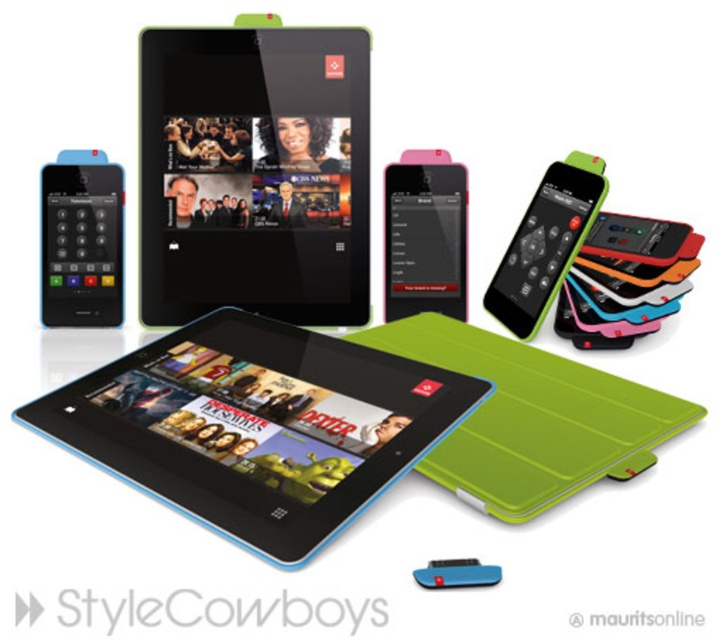
Question: Which point is closer to the camera?

Choices:
 (A) (585, 184)
 (B) (370, 442)

Answer: (B)

Question: Among these points, which one is farthest from the camera?

Choices:
 (A) (531, 291)
 (B) (114, 250)
 (C) (145, 481)
 (D) (446, 214)

Answer: (D)

Question: Is pink glossy ipod at center positioned behind green matte/ipod at upper right?

Choices:
 (A) yes
 (B) no

Answer: (A)

Question: Which point is farther to the camera?

Choices:
 (A) (244, 528)
 (B) (319, 180)

Answer: (B)

Question: Is black glossy tablet at center to the left of pink glossy ipod at center from the viewer's perspective?

Choices:
 (A) no
 (B) yes

Answer: (B)

Question: Is black glossy tablet at center bigger than blue matte/ipod at left?

Choices:
 (A) yes
 (B) no

Answer: (A)